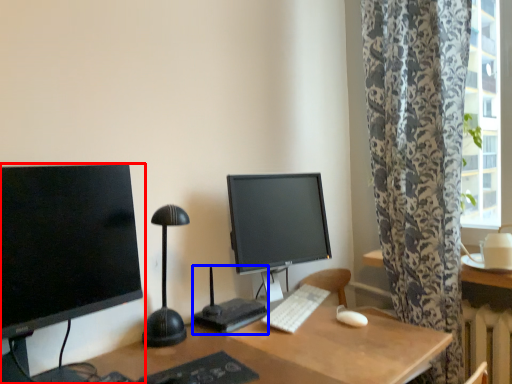
Question: Which object is closer to the camera taking this photo, computer monitor (highlighted by a red box) or computer desk (highlighted by a blue box)?

Choices:
 (A) computer monitor
 (B) computer desk

Answer: (A)